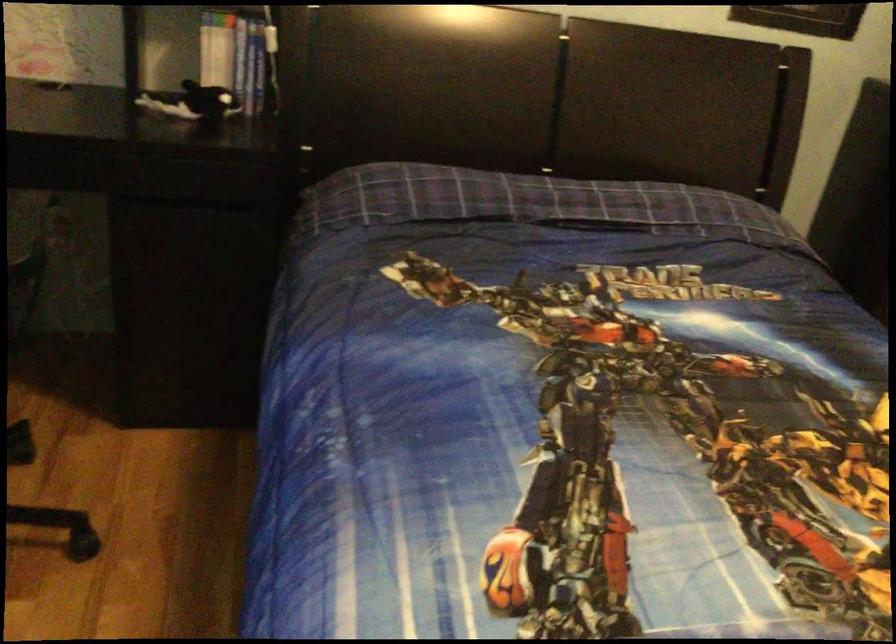
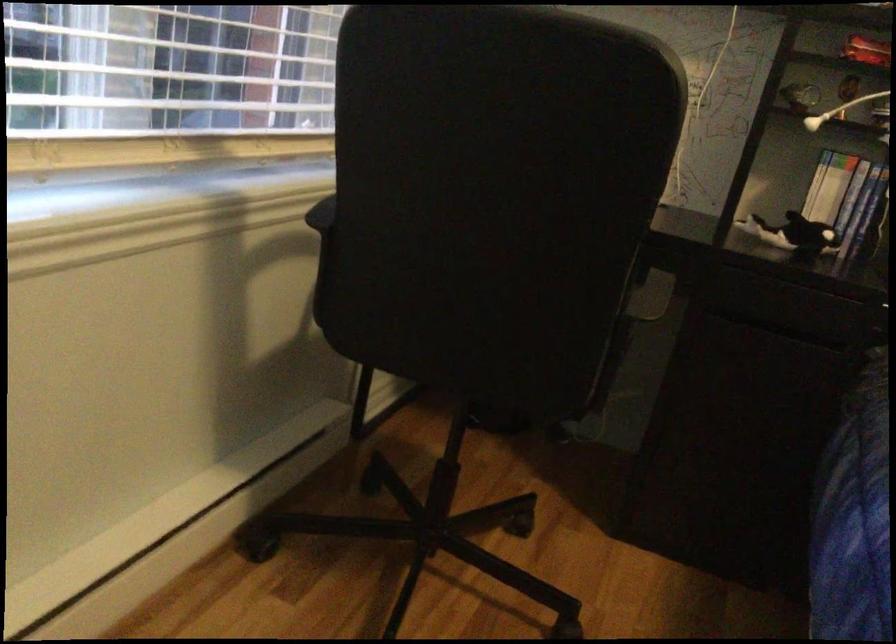
Locate, in the second image, the point that corresponds to point (194, 104) in the first image.

(793, 234)